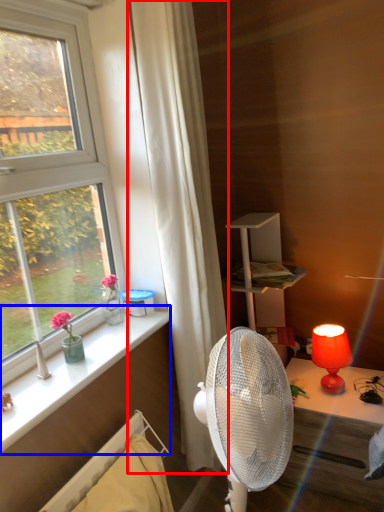
Question: Which object is closer to the camera taking this photo, curtain (highlighted by a red box) or window sill (highlighted by a blue box)?

Choices:
 (A) curtain
 (B) window sill

Answer: (B)